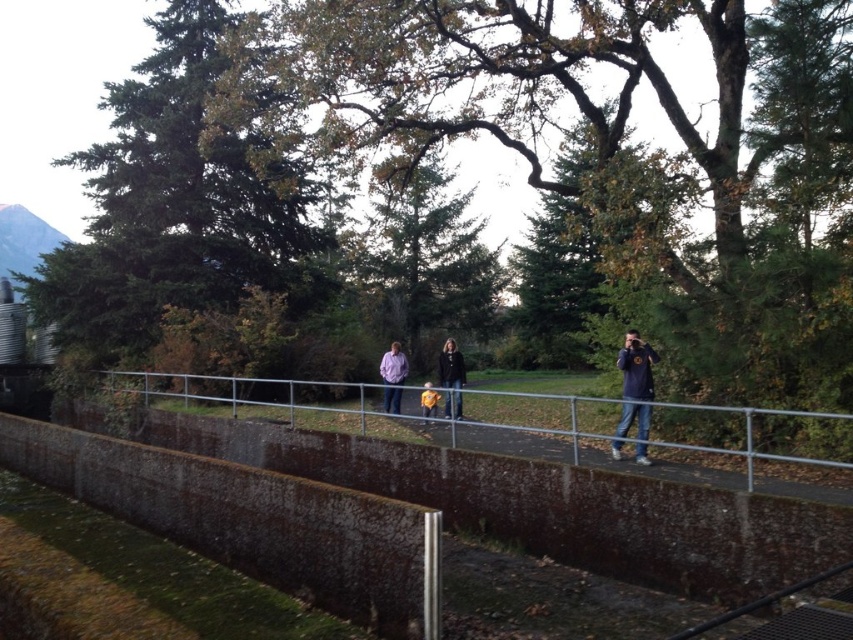
You are standing on the pathway and want to walk towards the point marked at coordinates point (271, 412) and point (425, 404). Which point will you reach first?

You will reach point (271, 412) first because it is closer to you than point (425, 404), which is further away.